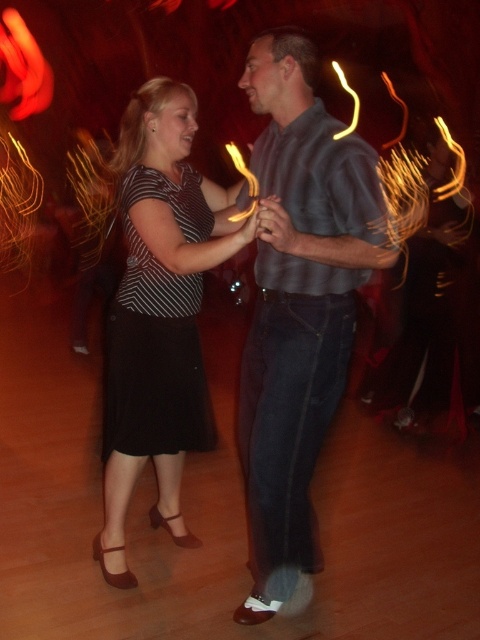
Is matte black dress at center shorter than black matte dress at center?

No.

Who is more forward, (157, 81) or (173, 401)?

Point (157, 81) is more forward.

Identify the location of matte black dress at center. (157, 316).

Who is positioned more to the left, dark blue jeans at center or black matte dress at center?

black matte dress at center

Which is below, dark blue jeans at center or black matte dress at center?

dark blue jeans at center is below.

Does point (262, 532) come farther from viewer compared to point (192, 234)?

No, (262, 532) is in front of (192, 234).

What are the coordinates of `dark blue jeans at center` in the screenshot? It's located at (298, 310).

Is the position of dark blue jeans at center less distant than that of matte black dress at center?

Yes, dark blue jeans at center is closer to the viewer.

Is dark blue jeans at center to the left of matte black dress at center from the viewer's perspective?

No, dark blue jeans at center is not to the left of matte black dress at center.

Which is behind, point (249, 401) or point (133, 579)?

Positioned behind is point (133, 579).

The image size is (480, 640). I want to click on dark blue jeans at center, so click(x=298, y=310).